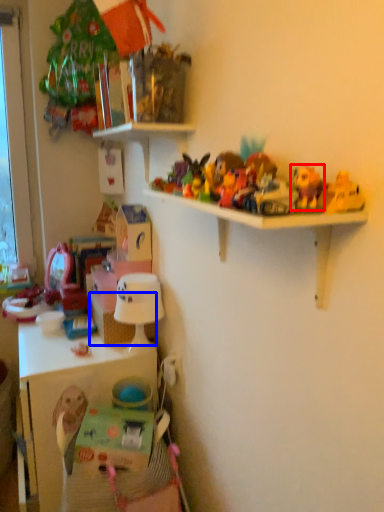
Question: Among these objects, which one is nearest to the camera, toy (highlighted by a red box) or basket (highlighted by a blue box)?

Choices:
 (A) toy
 (B) basket

Answer: (A)